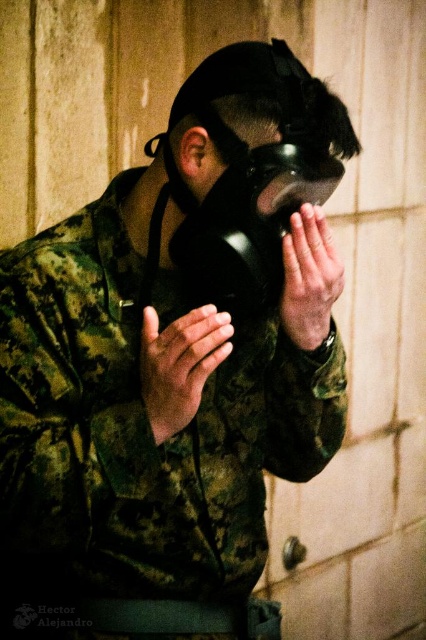
Question: Which of the following is the farthest from the observer?

Choices:
 (A) matte black hand at center
 (B) matte camouflage hand at center

Answer: (A)

Question: Is matte camouflage hand at center below matte black hand at center?

Choices:
 (A) no
 (B) yes

Answer: (B)

Question: Is matte camouflage hand at center positioned at the back of matte black hand at center?

Choices:
 (A) yes
 (B) no

Answer: (B)

Question: Which point appears closest to the camera in this image?

Choices:
 (A) (199, 362)
 (B) (288, 278)

Answer: (A)

Question: Does matte camouflage hand at center have a smaller size compared to matte black hand at center?

Choices:
 (A) yes
 (B) no

Answer: (B)

Question: Among these points, which one is nearest to the camera?

Choices:
 (A) (340, 262)
 (B) (157, 387)

Answer: (B)